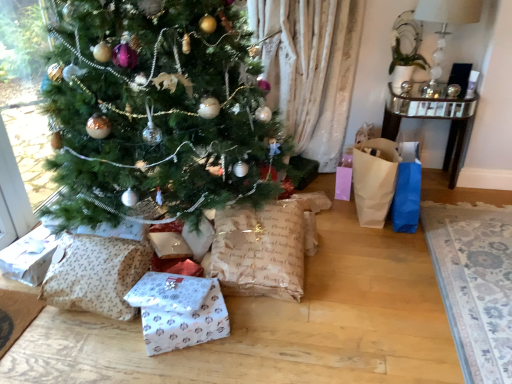
Question: From the image's perspective, is green matte christmas tree at center under patterned paper sack at lower left, the 2th sack in the right-to-left sequence?

Choices:
 (A) no
 (B) yes

Answer: (A)

Question: Considering the relative sizes of green matte christmas tree at center and patterned paper sack at lower left, the first sack when ordered from left to right, in the image provided, is green matte christmas tree at center thinner than patterned paper sack at lower left, the first sack when ordered from left to right,?

Choices:
 (A) yes
 (B) no

Answer: (B)

Question: Considering the relative sizes of green matte christmas tree at center and patterned paper sack at lower left, the first sack when ordered from left to right, in the image provided, is green matte christmas tree at center wider than patterned paper sack at lower left, the first sack when ordered from left to right,?

Choices:
 (A) yes
 (B) no

Answer: (A)

Question: Does green matte christmas tree at center come behind patterned paper sack at lower left, the first sack when ordered from left to right?

Choices:
 (A) no
 (B) yes

Answer: (A)

Question: Is green matte christmas tree at center outside of patterned paper sack at lower left, the first sack when ordered from left to right?

Choices:
 (A) no
 (B) yes

Answer: (B)

Question: From the image's perspective, is burlap paper sack at lower center, the second sack in the left-to-right sequence, located above or below patterned paper sack at lower left, the first sack when ordered from left to right?

Choices:
 (A) above
 (B) below

Answer: (A)

Question: Looking at their shapes, would you say burlap paper sack at lower center, arranged as the first sack when viewed from the right, is wider or thinner than patterned paper sack at lower left, the 2th sack in the right-to-left sequence?

Choices:
 (A) wide
 (B) thin

Answer: (A)

Question: Considering the positions of burlap paper sack at lower center, the second sack in the left-to-right sequence, and patterned paper sack at lower left, the first sack when ordered from left to right, in the image, is burlap paper sack at lower center, the second sack in the left-to-right sequence, bigger or smaller than patterned paper sack at lower left, the first sack when ordered from left to right,?

Choices:
 (A) small
 (B) big

Answer: (B)

Question: Would you say burlap paper sack at lower center, arranged as the first sack when viewed from the right, is inside or outside patterned paper sack at lower left, the first sack when ordered from left to right?

Choices:
 (A) outside
 (B) inside

Answer: (A)

Question: Considering the positions of patterned paper sack at lower left, the first sack when ordered from left to right, and white paper gift at lower center in the image, is patterned paper sack at lower left, the first sack when ordered from left to right, taller or shorter than white paper gift at lower center?

Choices:
 (A) short
 (B) tall

Answer: (B)

Question: Which is correct: patterned paper sack at lower left, the 2th sack in the right-to-left sequence, is inside white paper gift at lower center, or outside of it?

Choices:
 (A) outside
 (B) inside

Answer: (A)

Question: In terms of width, does patterned paper sack at lower left, the 2th sack in the right-to-left sequence, look wider or thinner when compared to white paper gift at lower center?

Choices:
 (A) thin
 (B) wide

Answer: (B)

Question: From a real-world perspective, is patterned paper sack at lower left, the first sack when ordered from left to right, positioned above or below white paper gift at lower center?

Choices:
 (A) above
 (B) below

Answer: (A)

Question: In the image, is white fabric lampshade at upper right on the left side or the right side of patterned paper sack at lower left, the 2th sack in the right-to-left sequence?

Choices:
 (A) right
 (B) left

Answer: (A)

Question: In the image, is white fabric lampshade at upper right positioned in front of or behind patterned paper sack at lower left, the 2th sack in the right-to-left sequence?

Choices:
 (A) behind
 (B) front

Answer: (A)